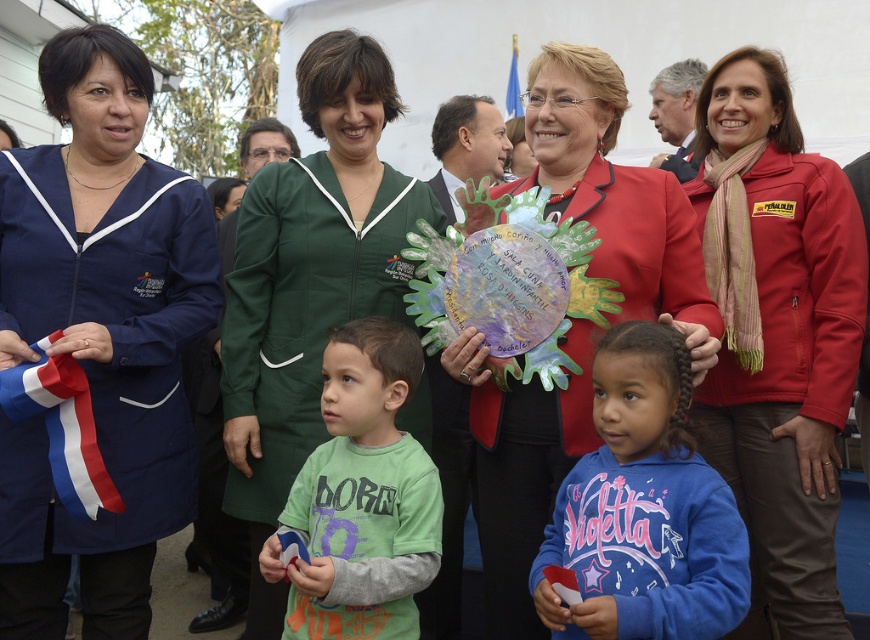
Question: Is the position of red matte jacket at center less distant than that of blue fleece sweatshirt at center?

Choices:
 (A) yes
 (B) no

Answer: (B)

Question: Does green fabric at center appear under green cotton shirt at center?

Choices:
 (A) yes
 (B) no

Answer: (B)

Question: Among these objects, which one is nearest to the camera?

Choices:
 (A) navy blue fabric coat at left
 (B) green cotton shirt at center

Answer: (B)

Question: Which is farther from the navy blue fabric coat at left?

Choices:
 (A) green fabric at center
 (B) green cotton shirt at center

Answer: (B)

Question: Which object is farther from the camera taking this photo?

Choices:
 (A) green cotton shirt at center
 (B) blue fleece sweatshirt at center

Answer: (A)

Question: Can you confirm if red matte jacket at center is bigger than blue fleece sweatshirt at center?

Choices:
 (A) yes
 (B) no

Answer: (A)